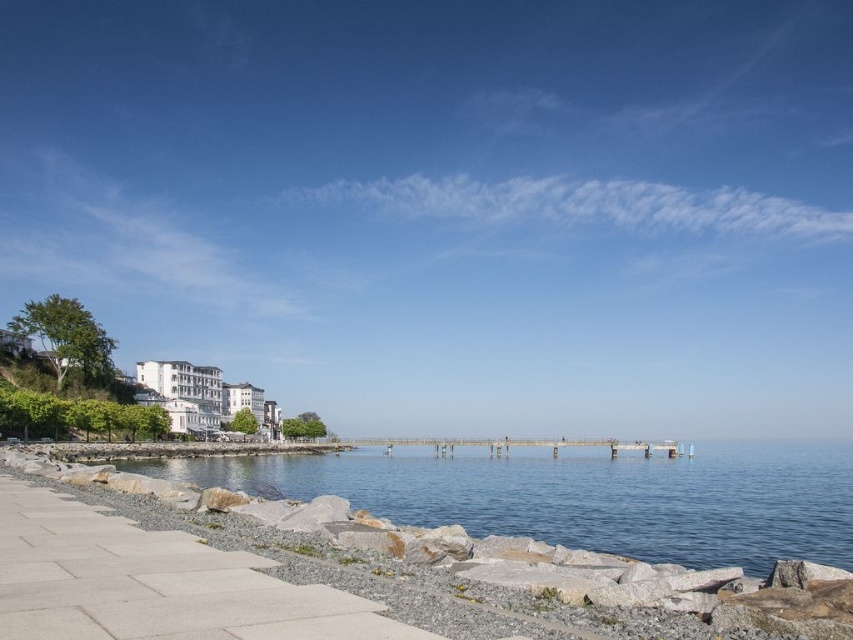
You are standing at the end of the wooden pier and want to walk towards the point labeled point (412, 472) and point (389, 621). Which point should you head towards if you want to reach the one closer to your current position?

You should head towards point (389, 621) because it is closer to your current position at the end of the wooden pier than point (412, 472), which is further away.

You are standing on the gray concrete pavement at lower left and want to reach the clear blue water at center. Which direction should you move to get there?

You should move to the right because the clear blue water at center is located to the right of the gray concrete pavement at lower left.